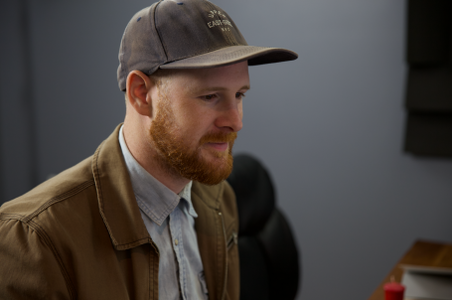
This screenshot has width=452, height=300. Find the location of `desk`. desk is located at coordinates (380, 292).